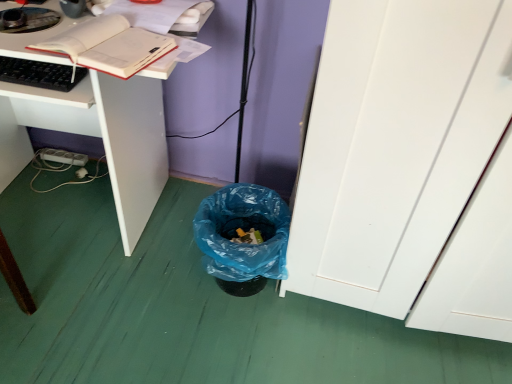
Question: Are black matte keyboard at left and matte white book at upper left far apart?

Choices:
 (A) yes
 (B) no

Answer: (B)

Question: Is black matte keyboard at left completely or partially outside of matte white book at upper left?

Choices:
 (A) yes
 (B) no

Answer: (A)

Question: Considering the relative sizes of black matte keyboard at left and matte white book at upper left in the image provided, is black matte keyboard at left smaller than matte white book at upper left?

Choices:
 (A) no
 (B) yes

Answer: (B)

Question: From the image's perspective, is black matte keyboard at left on matte white book at upper left?

Choices:
 (A) yes
 (B) no

Answer: (B)

Question: Is matte white book at upper left completely or partially inside black matte keyboard at left?

Choices:
 (A) yes
 (B) no

Answer: (B)

Question: In the image, is white matte desk at lower left positioned in front of or behind blue plastic trash can at lower center?

Choices:
 (A) behind
 (B) front

Answer: (B)

Question: From a real-world perspective, is white matte desk at lower left physically located above or below blue plastic trash can at lower center?

Choices:
 (A) above
 (B) below

Answer: (A)

Question: Considering the positions of white matte desk at lower left and blue plastic trash can at lower center in the image, is white matte desk at lower left taller or shorter than blue plastic trash can at lower center?

Choices:
 (A) short
 (B) tall

Answer: (B)

Question: Is white matte desk at lower left inside the boundaries of blue plastic trash can at lower center, or outside?

Choices:
 (A) inside
 (B) outside

Answer: (B)

Question: Is matte white book at upper left spatially inside blue plastic trash can at lower center, or outside of it?

Choices:
 (A) inside
 (B) outside

Answer: (B)

Question: From the image's perspective, is matte white book at upper left located above or below blue plastic trash can at lower center?

Choices:
 (A) above
 (B) below

Answer: (A)

Question: Is matte white book at upper left bigger or smaller than blue plastic trash can at lower center?

Choices:
 (A) big
 (B) small

Answer: (B)

Question: From a real-world perspective, is matte white book at upper left physically located above or below blue plastic trash can at lower center?

Choices:
 (A) below
 (B) above

Answer: (B)

Question: Based on their sizes in the image, would you say black matte keyboard at left is bigger or smaller than blue plastic trash can at lower center?

Choices:
 (A) big
 (B) small

Answer: (B)

Question: From a real-world perspective, is black matte keyboard at left above or below blue plastic trash can at lower center?

Choices:
 (A) above
 (B) below

Answer: (A)